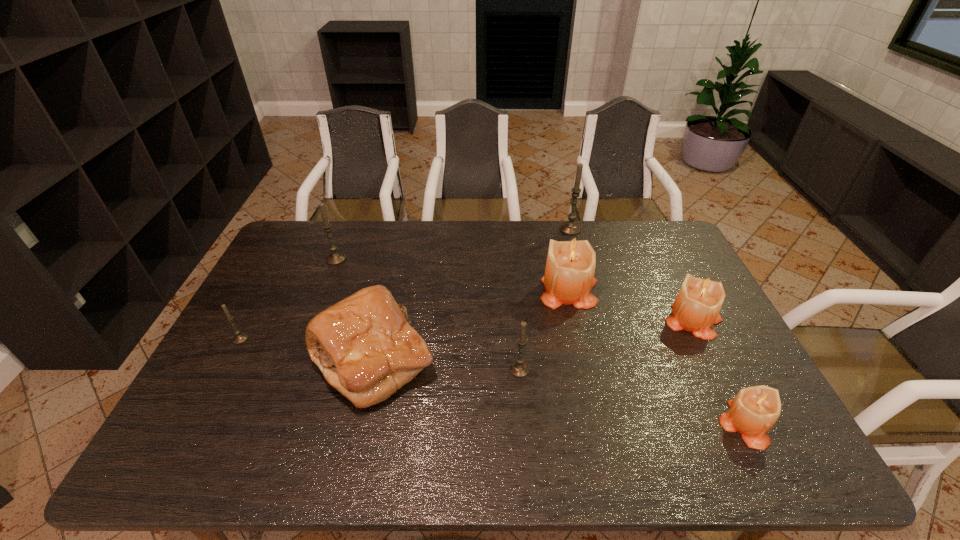
Identify which candle is the sixth nearest to the rightmost gray candle. Please provide its 2D coordinates. Your answer should be formatted as a tuple, i.e. [(x, y)], where the tuple contains the x and y coordinates of a point satisfying the conditions above.

[(239, 338)]

Identify which gray candle is located as the second nearest to the tallest candle. Please provide its 2D coordinates. Your answer should be formatted as a tuple, i.e. [(x, y)], where the tuple contains the x and y coordinates of a point satisfying the conditions above.

[(334, 258)]

You are a GUI agent. You are given a task and a screenshot of the screen. Output one action in this format:
    pyautogui.click(x=<x>, y=<y>)
    Task: Click on the gray candle that can be found as the closest to the second smallest beige candle
    The width and height of the screenshot is (960, 540).
    Given the screenshot: What is the action you would take?
    pyautogui.click(x=571, y=227)

Select which beige candle appears as the closest to the leftmost object. Please provide its 2D coordinates. Your answer should be formatted as a tuple, i.e. [(x, y)], where the tuple contains the x and y coordinates of a point satisfying the conditions above.

[(569, 277)]

Choose which beige candle is the third nearest neighbor to the second biggest gray candle. Please provide its 2D coordinates. Your answer should be formatted as a tuple, i.e. [(x, y)], where the tuple contains the x and y coordinates of a point satisfying the conditions above.

[(753, 412)]

Where is `vacant region that satisfies the following two spatial constraints: 1. on the back side of the second biggest beige candle; 2. on the left side of the leftmost candle`? This screenshot has width=960, height=540. vacant region that satisfies the following two spatial constraints: 1. on the back side of the second biggest beige candle; 2. on the left side of the leftmost candle is located at coordinates (250, 321).

Where is `free space that satisfies the following two spatial constraints: 1. on the back side of the third biggest gray candle; 2. on the filling side of the brownish-beige bread`? Image resolution: width=960 pixels, height=540 pixels. free space that satisfies the following two spatial constraints: 1. on the back side of the third biggest gray candle; 2. on the filling side of the brownish-beige bread is located at coordinates (518, 360).

You are a GUI agent. You are given a task and a screenshot of the screen. Output one action in this format:
    pyautogui.click(x=<x>, y=<y>)
    Task: Click on the free space in the image that satisfies the following two spatial constraints: 1. on the front side of the biggest beige candle; 2. on the left side of the third smallest gray candle
    
    Given the screenshot: What is the action you would take?
    pyautogui.click(x=324, y=289)

This screenshot has width=960, height=540. In order to click on blank space that satisfies the following two spatial constraints: 1. on the front side of the rightmost gray candle; 2. on the right side of the second smallest beige candle in this screenshot , I will do `click(595, 321)`.

You are a GUI agent. You are given a task and a screenshot of the screen. Output one action in this format:
    pyautogui.click(x=<x>, y=<y>)
    Task: Click on the free location that satisfies the following two spatial constraints: 1. on the filling side of the smallest beige candle; 2. on the right side of the third object from left to right
    
    Given the screenshot: What is the action you would take?
    pyautogui.click(x=358, y=424)